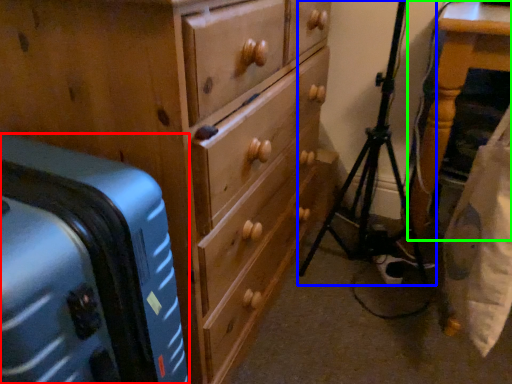
Question: Estimate the real-world distances between objects in this image. Which object is farther from suitcase (highlighted by a red box), tripod (highlighted by a blue box) or furniture (highlighted by a green box)?

Choices:
 (A) tripod
 (B) furniture

Answer: (B)